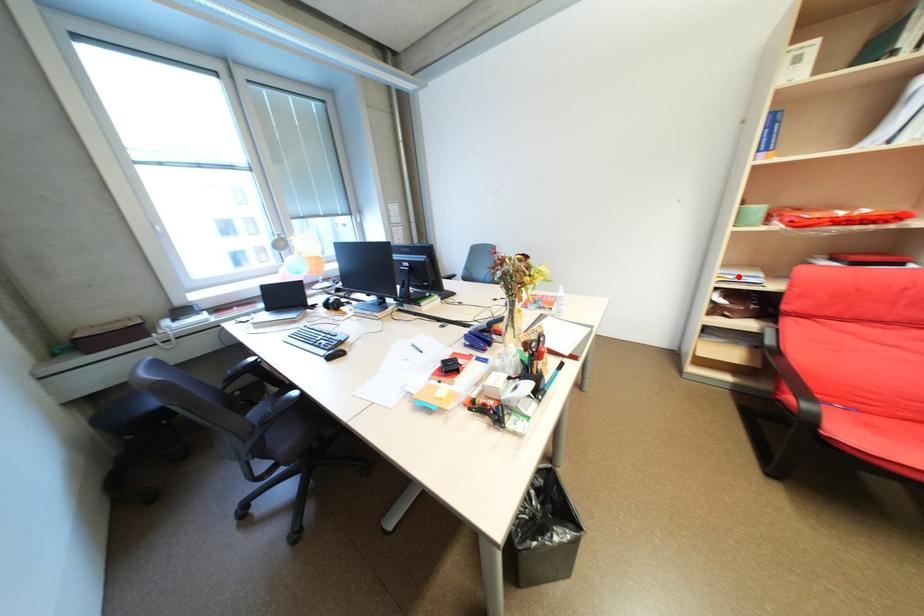
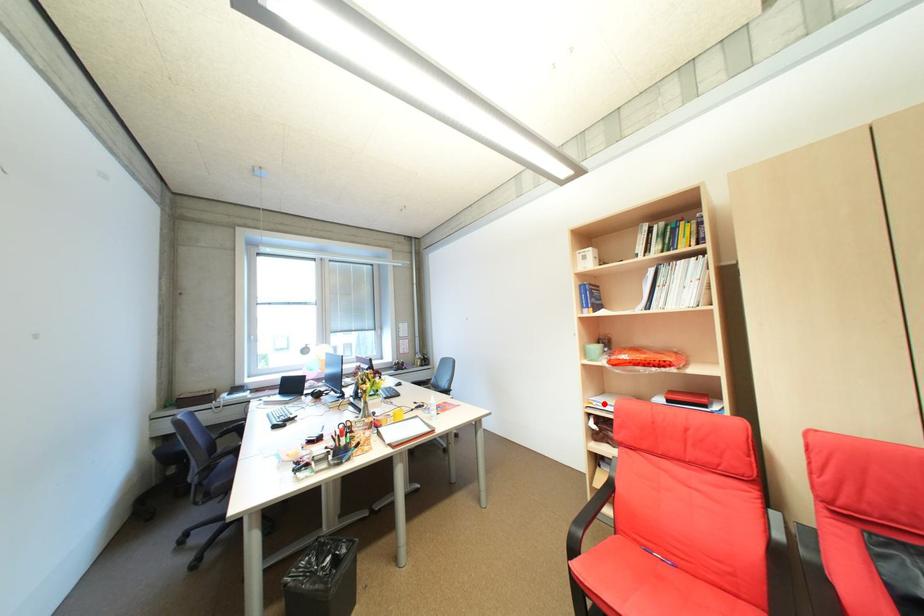
I am providing you with two images of the same scene from different viewpoints. A red point is marked on the first image and another point is marked on the second image. Does the point marked in image1 correspond to the same location as the one in image2?

Yes